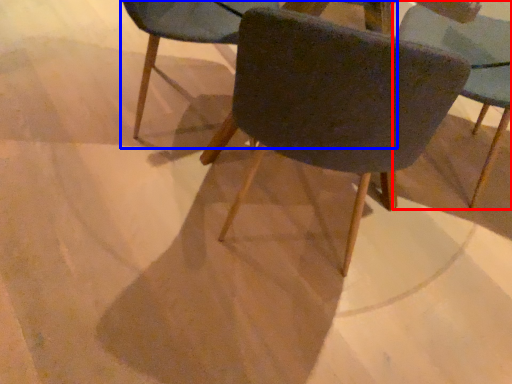
Question: Which object is closer to the camera taking this photo, chair (highlighted by a red box) or chair (highlighted by a blue box)?

Choices:
 (A) chair
 (B) chair

Answer: (A)